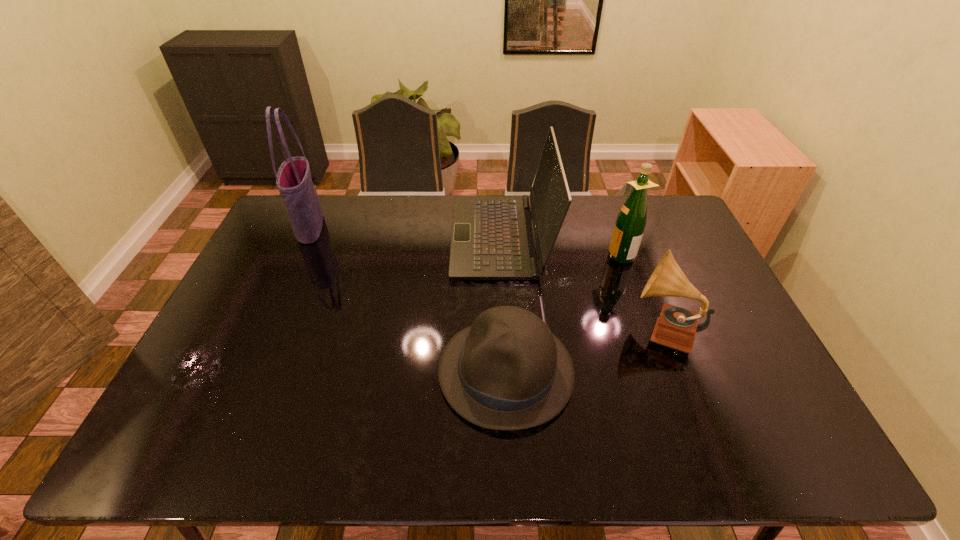
You are a GUI agent. You are given a task and a screenshot of the screen. Output one action in this format:
    pyautogui.click(x=<x>, y=<y>)
    Task: Click on the tallest object
    The height and width of the screenshot is (540, 960).
    Given the screenshot: What is the action you would take?
    pyautogui.click(x=293, y=179)

You are a GUI agent. You are given a task and a screenshot of the screen. Output one action in this format:
    pyautogui.click(x=<x>, y=<y>)
    Task: Click on the tote bag
    This screenshot has width=960, height=540.
    Given the screenshot: What is the action you would take?
    pyautogui.click(x=293, y=179)

Locate an element on the screen. liquor is located at coordinates (628, 231).

Locate an element on the screen. This screenshot has width=960, height=540. laptop computer is located at coordinates (492, 238).

The width and height of the screenshot is (960, 540). Find the location of `phonograph record`. phonograph record is located at coordinates (676, 327).

Locate an element on the screen. Image resolution: width=960 pixels, height=540 pixels. bowler hat is located at coordinates (508, 371).

I want to click on free region located on the right of the leftmost object, so click(x=364, y=227).

The width and height of the screenshot is (960, 540). Find the location of `vacant region located on the front-facing side of the liquor`. vacant region located on the front-facing side of the liquor is located at coordinates (493, 254).

Locate an element on the screen. Image resolution: width=960 pixels, height=540 pixels. vacant space located 0.280m on the front-facing side of the liquor is located at coordinates (520, 254).

I want to click on free space located 0.390m on the front-facing side of the liquor, so click(487, 254).